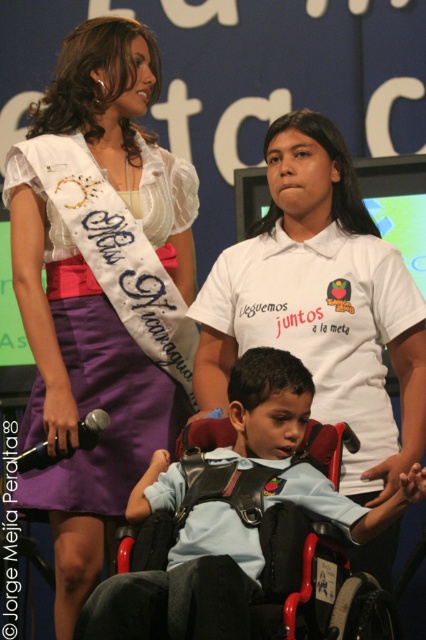
Does point (374, 348) lie in front of point (270, 428)?

No, it is behind (270, 428).

Is point (388, 438) more distant than point (249, 432)?

That is True.

Which is behind, point (302, 154) or point (331, 486)?

The point (302, 154) is behind.

You are a GUI agent. You are given a task and a screenshot of the screen. Output one action in this format:
    pyautogui.click(x=<x>, y=<y>)
    Task: Click on the white cotton shirt at center
    The width and height of the screenshot is (426, 640).
    Given the screenshot: What is the action you would take?
    pyautogui.click(x=322, y=304)

Can you confirm if purple satin sash at upper center is smaller than light blue fabric shirt at center?

Indeed, purple satin sash at upper center has a smaller size compared to light blue fabric shirt at center.

Does point (189, 168) come in front of point (206, 572)?

No, (189, 168) is behind (206, 572).

Find the location of a particular element. This screenshot has width=426, height=640. purple satin sash at upper center is located at coordinates tap(112, 316).

Between point (235, 256) and point (109, 224), which one is positioned behind?

Positioned behind is point (235, 256).

Image resolution: width=426 pixels, height=640 pixels. Identify the location of white cotton shirt at center. click(322, 304).